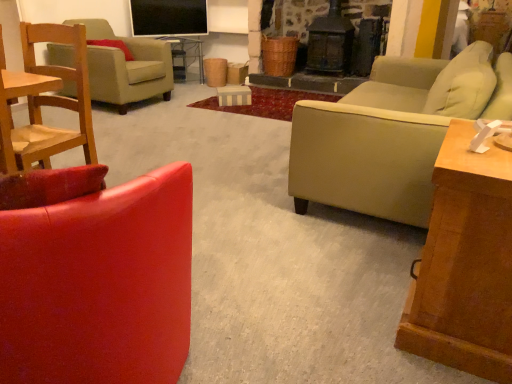
This screenshot has height=384, width=512. Find the location of `vacant space positioned to the left of beige leather couch at right`. vacant space positioned to the left of beige leather couch at right is located at coordinates (226, 153).